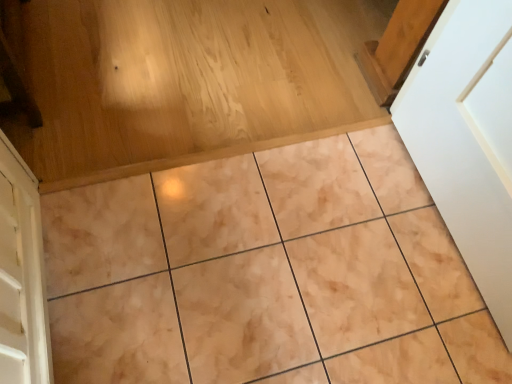
Image resolution: width=512 pixels, height=384 pixels. Identify the location of marble tile at center. (266, 274).

The image size is (512, 384). What do you see at coordinates (266, 274) in the screenshot?
I see `marble tile at center` at bounding box center [266, 274].

Locate an element on the screen. The width and height of the screenshot is (512, 384). marble tile at center is located at coordinates (266, 274).